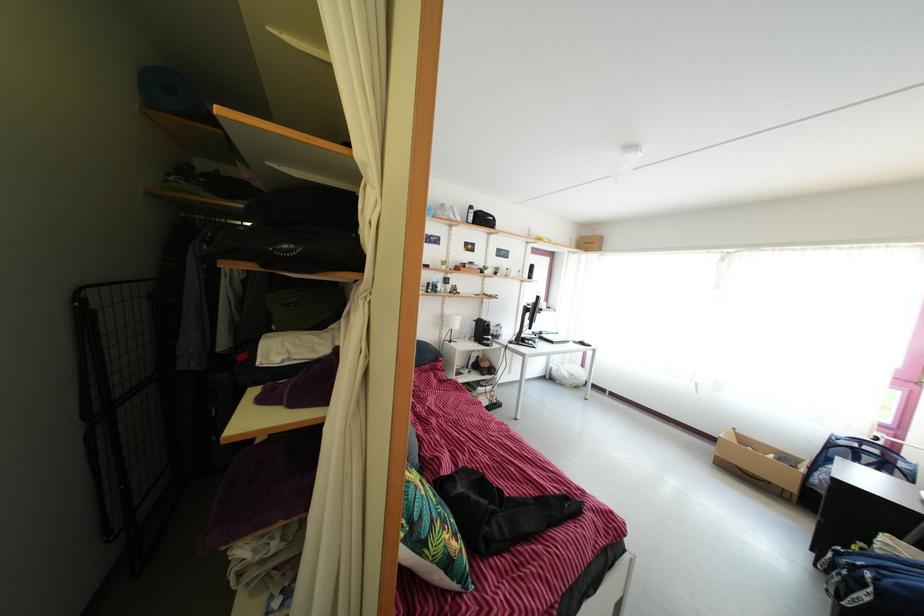
Describe the element at coordinates (127, 410) in the screenshot. I see `the black drying rack` at that location.